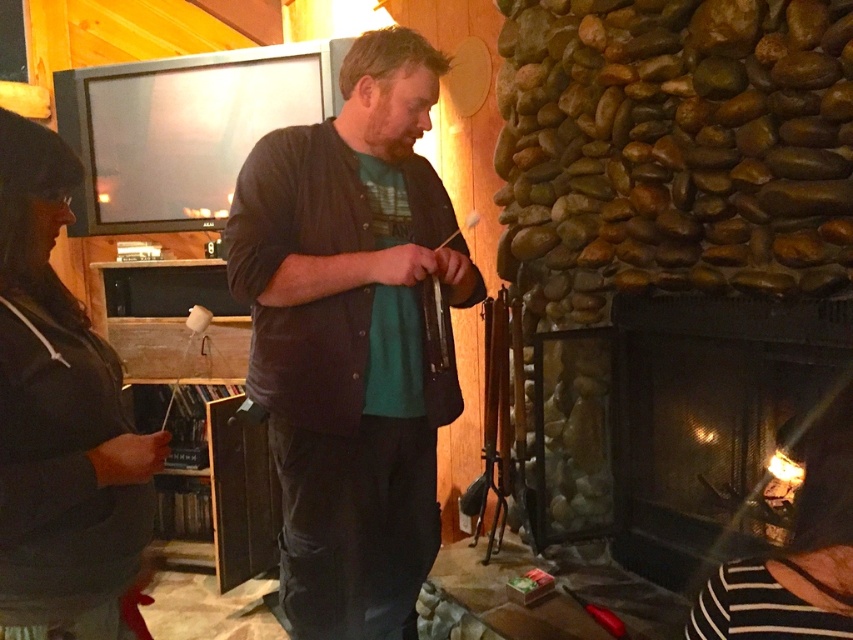
You are planning to place a decorative item on the black glass fireplace at lower right. Considering the dark gray sweater at left is currently placed on the fireplace, will the decorative item fit if it requires more space than the sweater?

The black glass fireplace at lower right is wider than the dark gray sweater at left, so the decorative item requiring more space than the sweater should fit on the fireplace.

You are standing in the living room and want to place a decorative item on the surface of the black glass fireplace at lower right. However, you notice the dark gray sweater at left is hanging nearby. Is the fireplace surface accessible for placing the item without moving the sweater?

The black glass fireplace at lower right is below dark gray sweater at left, so the fireplace surface is accessible for placing the item without needing to move the sweater since it is positioned lower than the sweater.

You are standing in the living room and want to place a small decorative item on the floor. You have two options for placement based on coordinates provided. Which coordinate point, point 1 at (306,460) or point 2 at (636,438), is closer to the viewer and thus more visible?

Point 1 at (306,460) is closer to the viewer and therefore more visible than point 2 at (636,438).